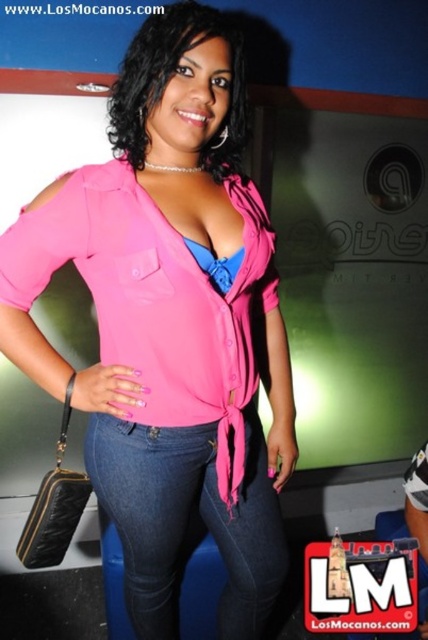
Question: Can you confirm if pink matte shirt at center is positioned to the right of denim jeans at center?

Choices:
 (A) no
 (B) yes

Answer: (A)

Question: Which point is farther from the camera taking this photo?

Choices:
 (A) (259, 634)
 (B) (193, 492)

Answer: (A)

Question: From the image, what is the correct spatial relationship of pink matte shirt at center in relation to denim jeans at center?

Choices:
 (A) left
 (B) right

Answer: (A)

Question: Which point is farther to the camera?

Choices:
 (A) (174, 504)
 (B) (97, 436)

Answer: (A)

Question: Which of the following is the farthest from the observer?

Choices:
 (A) (276, 579)
 (B) (121, 470)

Answer: (A)

Question: Can you confirm if pink matte shirt at center is bigger than denim jeans at center?

Choices:
 (A) yes
 (B) no

Answer: (A)